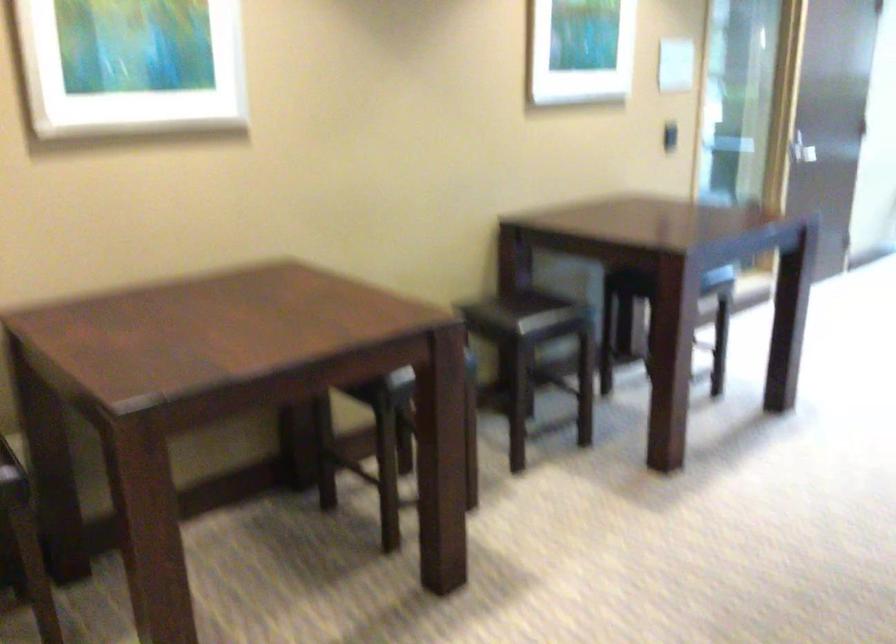
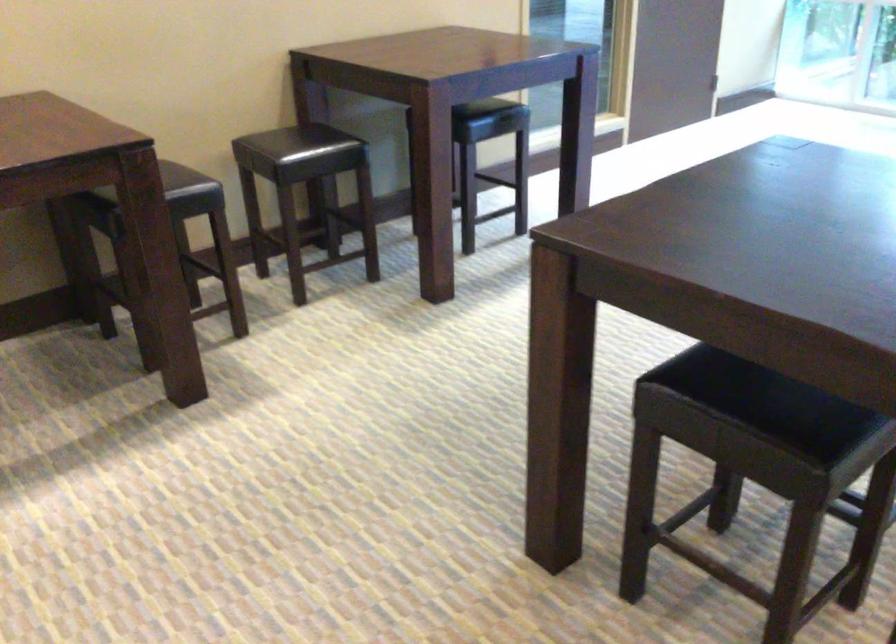
What movement of the cameraman would produce the second image?

The cameraman walked toward right, backward.